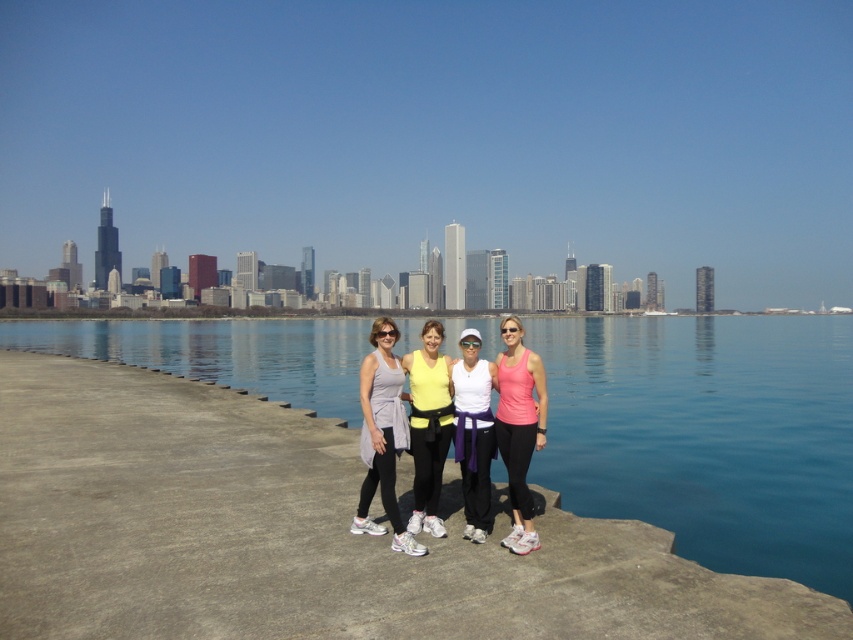
You are a photographer trying to capture a photo of the blue smooth water at center and the pink matte tank top at center. Can you fit both subjects into your camera frame if your camera has a maximum viewing range of 100 meters?

The blue smooth water at center and pink matte tank top at center are 110.31 meters apart, which exceeds the camera frame viewing range of 100 meters. Therefore, both subjects cannot be captured in a single frame.

You are a photographer standing on the pier and want to capture a photo that includes both the blue smooth water at center and the white matte tank top at center. Given that your camera has a maximum focus range of 70 meters, will you be able to focus on both subjects simultaneously?

The distance between the blue smooth water at center and the white matte tank top at center is 68.10 meters. Since the camera can focus up to 70 meters, both subjects are within the focus range, so yes, you can focus on both.